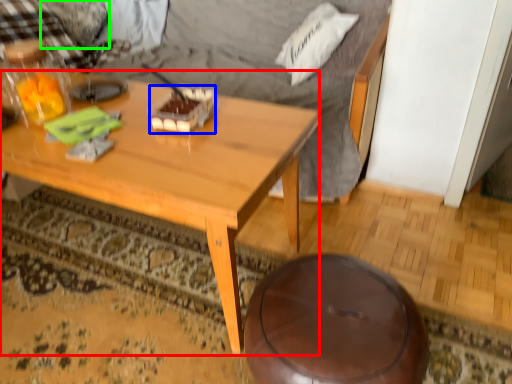
Question: Estimate the real-world distances between objects in this image. Which object is closer to coffee table (highlighted by a red box), food (highlighted by a blue box) or pillow (highlighted by a green box)?

Choices:
 (A) food
 (B) pillow

Answer: (A)